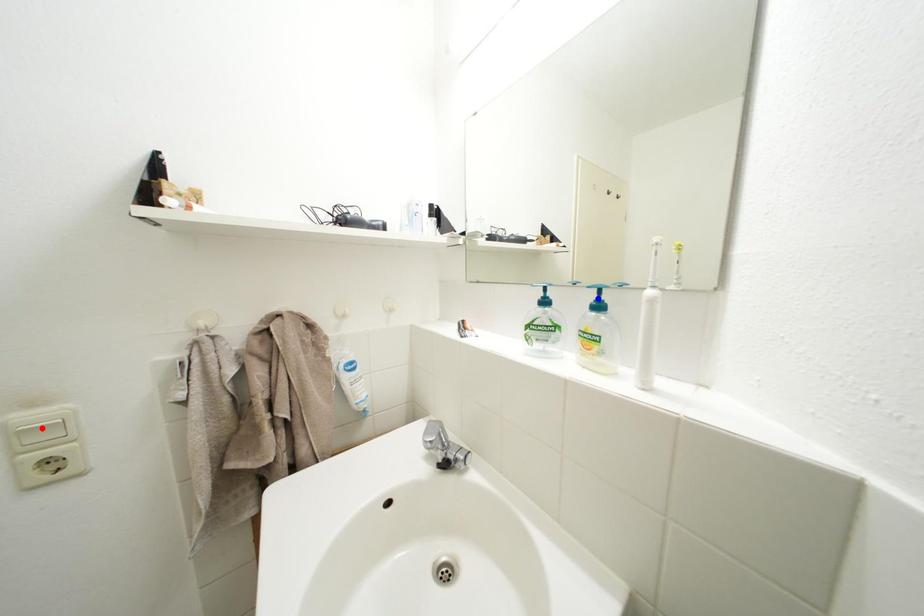
Question: In the image, two points are highlighted. Which point is nearer to the camera? Reply with the corresponding letter.

Choices:
 (A) blue point
 (B) red point

Answer: (B)